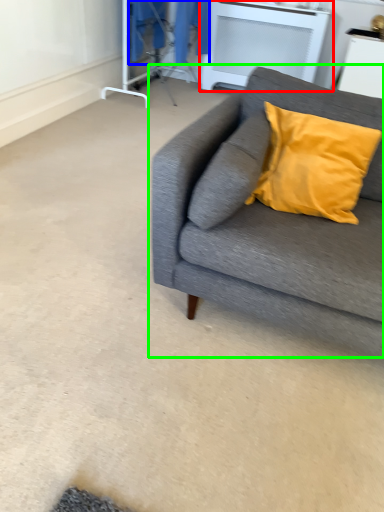
Question: Which is nearer to the table (highlighted by a red box)? laundry (highlighted by a blue box) or studio couch (highlighted by a green box).

Choices:
 (A) laundry
 (B) studio couch

Answer: (A)